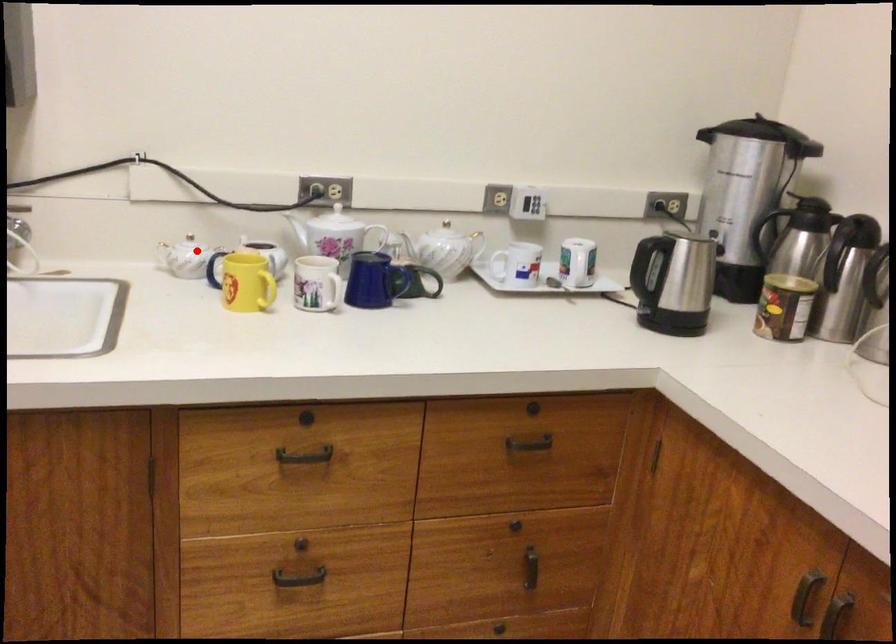
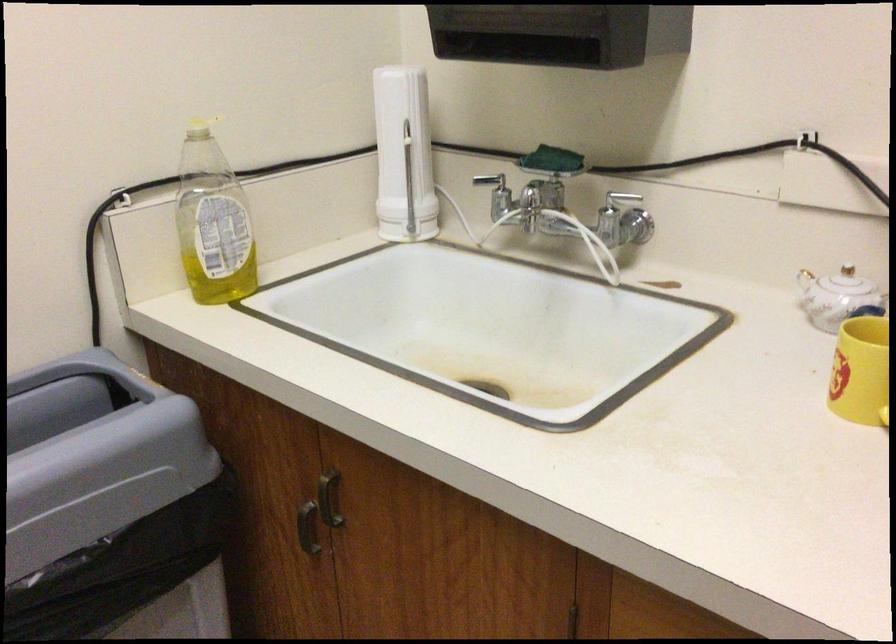
Find the pixel in the second image that matches the highlighted location in the first image.

(848, 287)